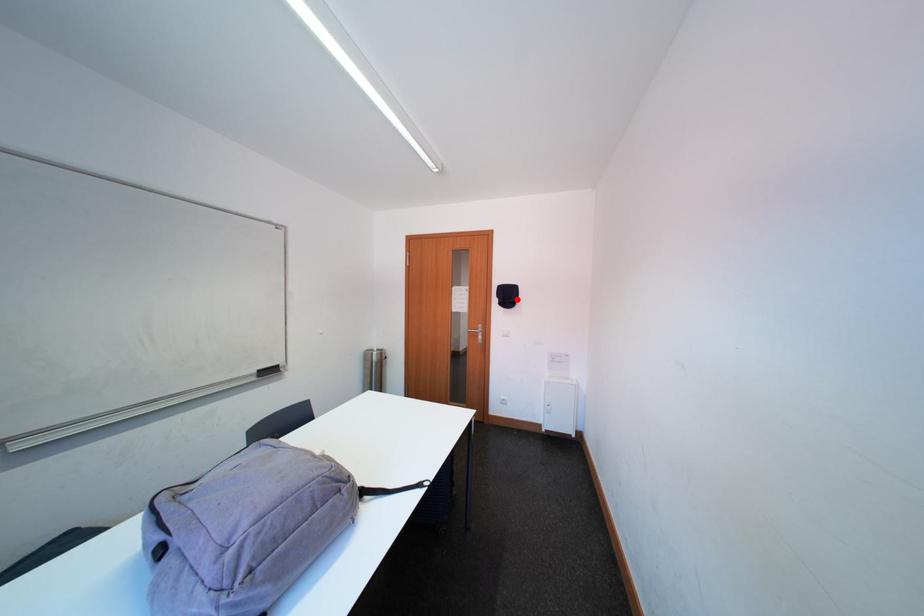
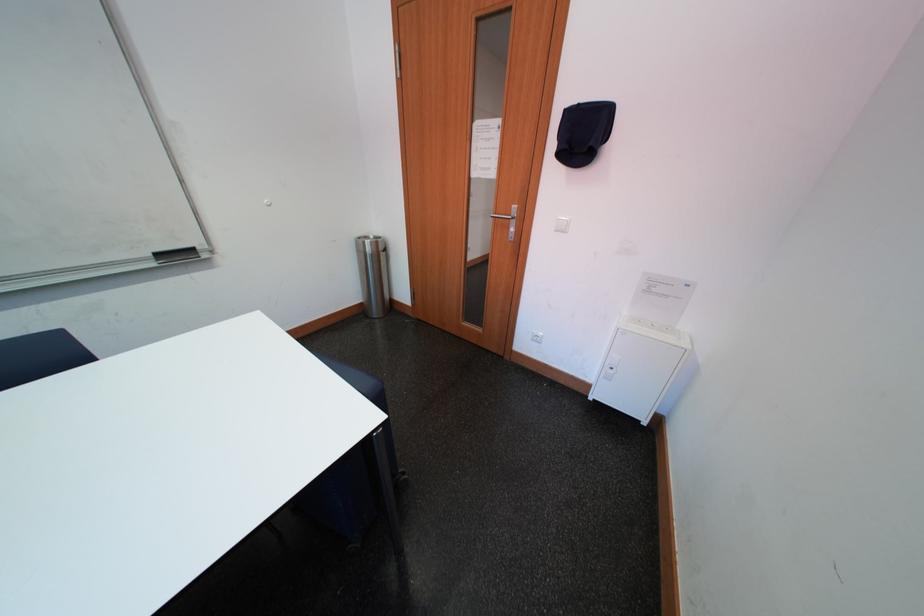
Question: I am providing you with two images of the same scene from different viewpoints. A red point is marked on the first image. Can you still see the location of the red point in image 2?

Choices:
 (A) Yes
 (B) No

Answer: (A)